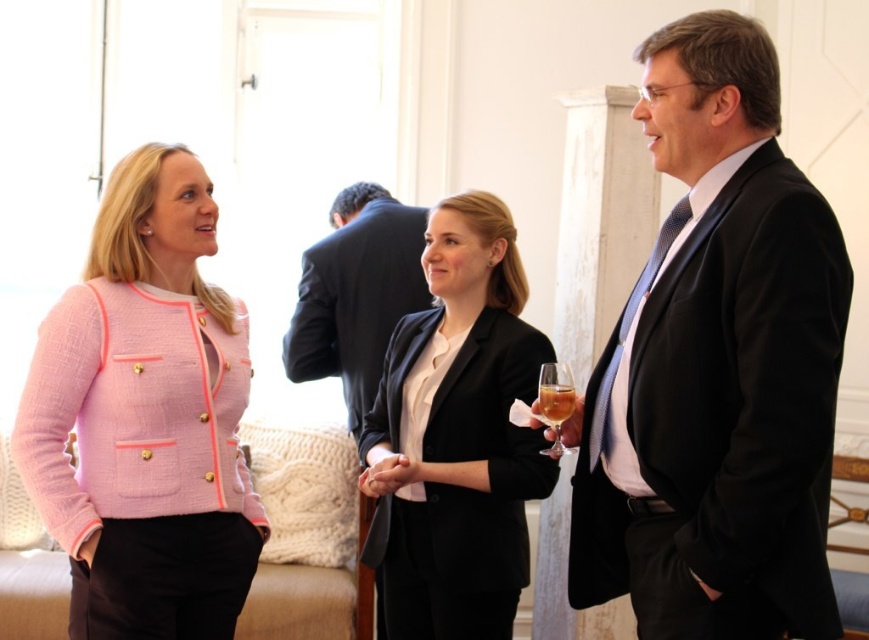
You are taking a photo of the scene and want to focus on both point (x=150, y=301) and point (x=548, y=445). Which point should you focus on first to ensure both are in focus?

You should focus on point (x=150, y=301) first because it is closer to the camera than point (x=548, y=445), ensuring both points are within the depth of field.

You are a photographer at the event and want to capture a photo that includes both the matte black suit at right and the translucent glass at center. Which object should you position closer to the camera to ensure both are in focus?

The matte black suit at right is much taller than the translucent glass at center. To ensure both are in focus, position the translucent glass at center closer to the camera so that its smaller size compensates for the depth difference.

You are a photographer who needs to adjust the distance between the matte black suit at right and the camera to ensure optimal focus. The recommended distance for sharp focus is between 5 and 6 feet. Is the current distance within the recommended range?

The matte black suit at right and camera are 5.17 feet apart from each other, which is within the recommended 5 to 6 feet range for optimal focus.